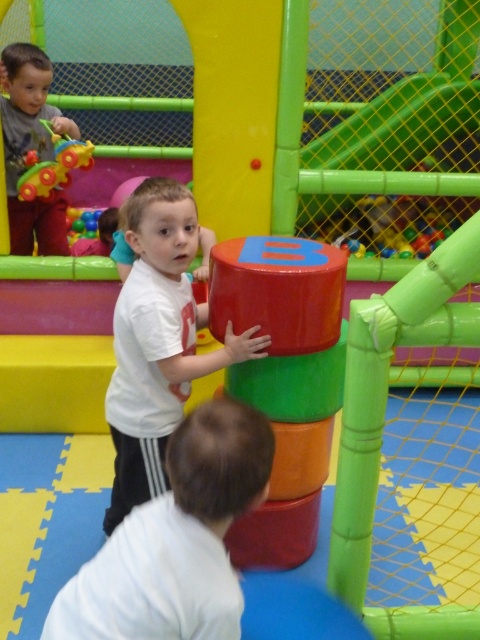
You are a parent trying to decide if a small storage box that is 12 inches wide can fit both the white matte shirt at lower center and the matte black toy car at left without overlapping. Based on the scene, can you determine if both items will fit side by side in the box?

The white matte shirt at lower center might be wider than matte black toy car at left, so the combined width of both items could exceed the 12 inch box. It is uncertain if they will fit without overlapping.

You are a parent in the play area and want to ensure the two children, wearing white matte shirt at lower center and matte white shirt at center, are within a safe distance of each other. According to the safety guidelines, children must be within 1 meter of each other for supervision. Can you confirm if they are within the required distance?

The white matte shirt at lower center and matte white shirt at center are 79.74 centimeters apart, which is less than 1 meter. Therefore, the children are within the required safe distance for supervision.